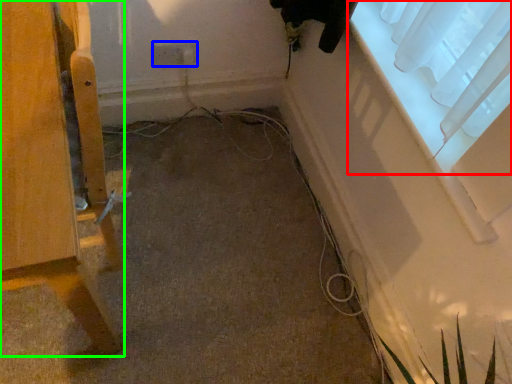
Question: Which object is positioned farthest from window (highlighted by a red box)? Select from electric outlet (highlighted by a blue box) and furniture (highlighted by a green box).

Choices:
 (A) electric outlet
 (B) furniture

Answer: (B)